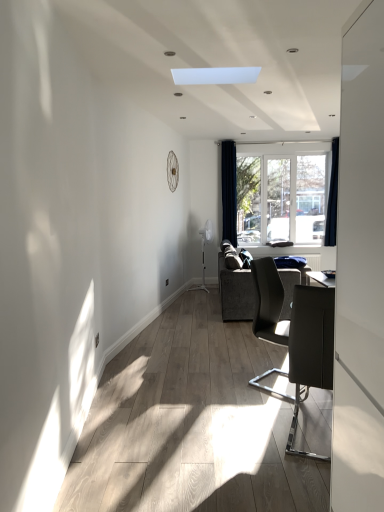
Question: Do you think dark blue fabric curtain at right, which is the first curtain in right-to-left order, is within clear glass window at center, or outside of it?

Choices:
 (A) outside
 (B) inside

Answer: (A)

Question: In terms of width, does dark blue fabric curtain at right, which is the first curtain in right-to-left order, look wider or thinner when compared to clear glass window at center?

Choices:
 (A) wide
 (B) thin

Answer: (A)

Question: Which is farther from the clear glass window at center?

Choices:
 (A) matte black chair at right, the 1th chair positioned from the front
 (B) dark blue velvet curtain at right, the first curtain when ordered from left to right
 (C) dark blue fabric curtain at right, the second curtain from the left
 (D) matte black chair at center right, positioned as the first chair in back-to-front order
 (E) white glossy screen door at right

Answer: (E)

Question: Estimate the real-world distances between objects in this image. Which object is farther from the dark blue velvet curtain at right, acting as the second curtain starting from the right?

Choices:
 (A) white glossy screen door at right
 (B) clear glass window at center
 (C) matte black chair at right, the 1th chair positioned from the front
 (D) matte black chair at center right, arranged as the 2th chair when viewed from the front
 (E) dark gray fabric couch at center

Answer: (A)